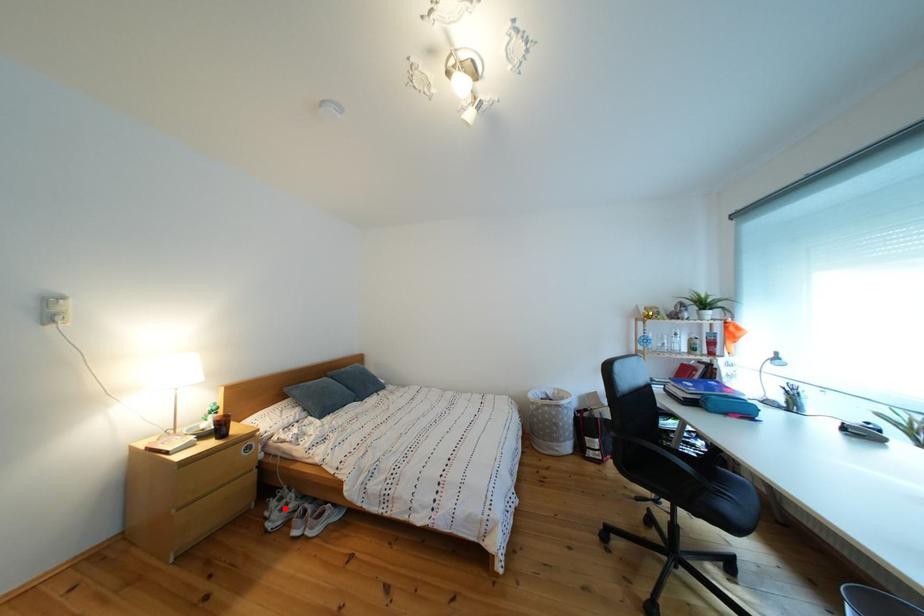
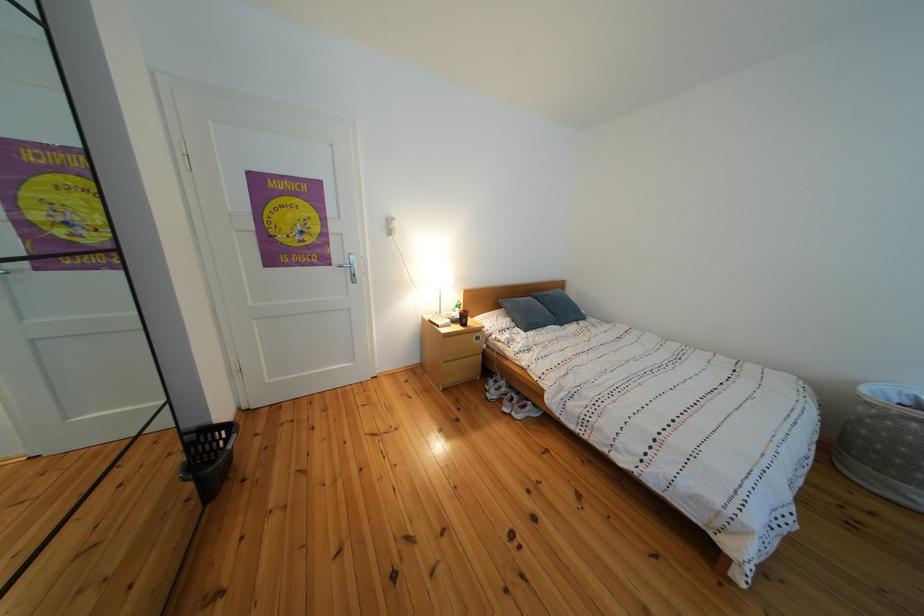
Question: I am providing you with two images of the same scene from different viewpoints. Given a red point in image1, look at the same physical point in image2. Is it:

Choices:
 (A) Closer to the viewpoint
 (B) Farther from the viewpoint

Answer: (A)